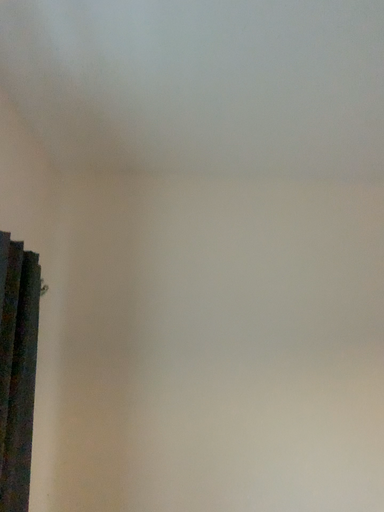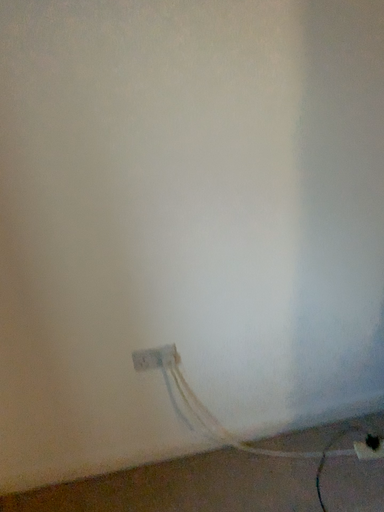
Question: How did the camera likely rotate when shooting the video?

Choices:
 (A) rotated downward
 (B) rotated upward

Answer: (A)